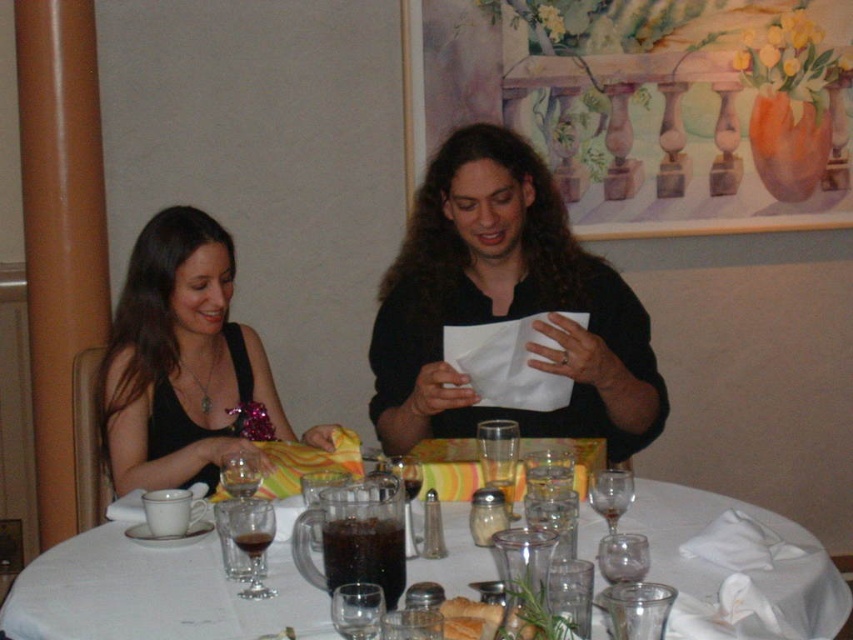
Does transparent glass wine glass at center appear over transparent glass at center?

Yes.

Can you confirm if transparent glass wine glass at center is smaller than transparent glass at center?

Actually, transparent glass wine glass at center might be larger than transparent glass at center.

You are a GUI agent. You are given a task and a screenshot of the screen. Output one action in this format:
    pyautogui.click(x=<x>, y=<y>)
    Task: Click on the transparent glass wine glass at center
    This screenshot has height=640, width=853.
    Given the screenshot: What is the action you would take?
    pyautogui.click(x=252, y=540)

Between transparent glass wine glass at center and golden brown bread at center, which one is positioned lower?

golden brown bread at center

This screenshot has width=853, height=640. What do you see at coordinates (252, 540) in the screenshot?
I see `transparent glass wine glass at center` at bounding box center [252, 540].

I want to click on transparent glass wine glass at center, so (252, 540).

Who is lower down, black matte dress at left or transparent glass wine glass at table center?

transparent glass wine glass at table center is lower down.

Looking at this image, who is more distant from viewer, (169, 346) or (596, 499)?

Positioned behind is point (169, 346).

At what (x,y) coordinates should I click in order to perform the action: click on black matte dress at left. Please return your answer as a coordinate pair (x, y). The height and width of the screenshot is (640, 853). Looking at the image, I should click on (180, 362).